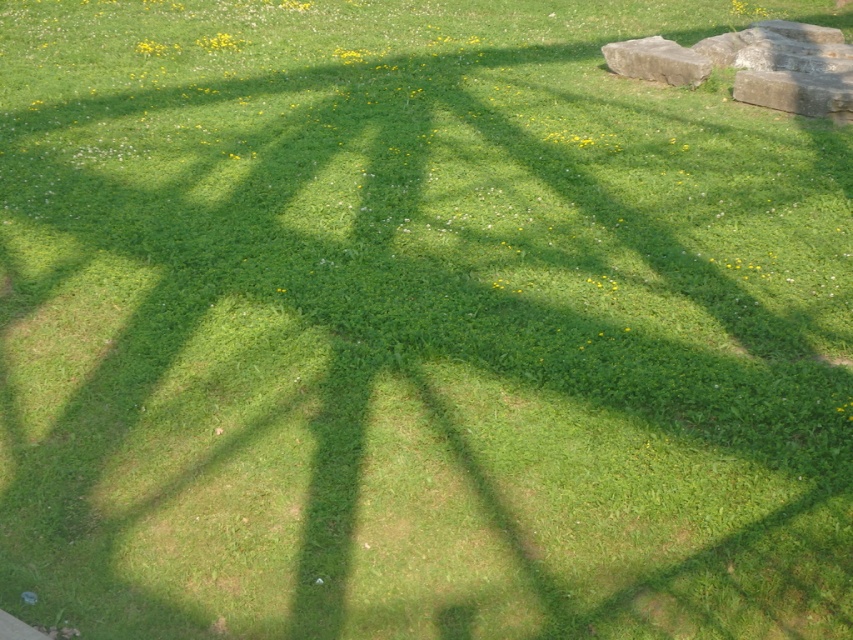
You are a landscape designer planning to place a new decorative stone in the grassy area. You have two options from the image, the gray stone at upper right and the gray rough stone at upper right. Which stone is wider so that it can cast a larger shadow to cover more of the lighter grass patches?

The gray stone at upper right is wider than the gray rough stone at upper right, so it will cast a larger shadow to cover more of the lighter grass patches.

Based on the photo, you are a landscape designer planning to place a new decorative stone in the grassy area. You have two options from the image, the gray stone at upper right and the gray rough stone at upper right. Which stone takes up more space in the image?

The gray rough stone at upper right occupies more space than the gray stone at upper right.